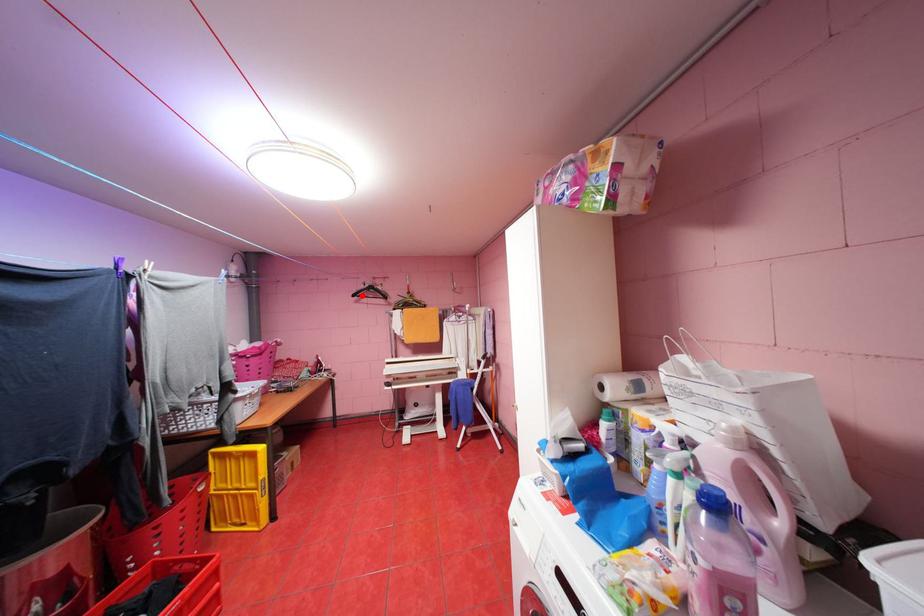
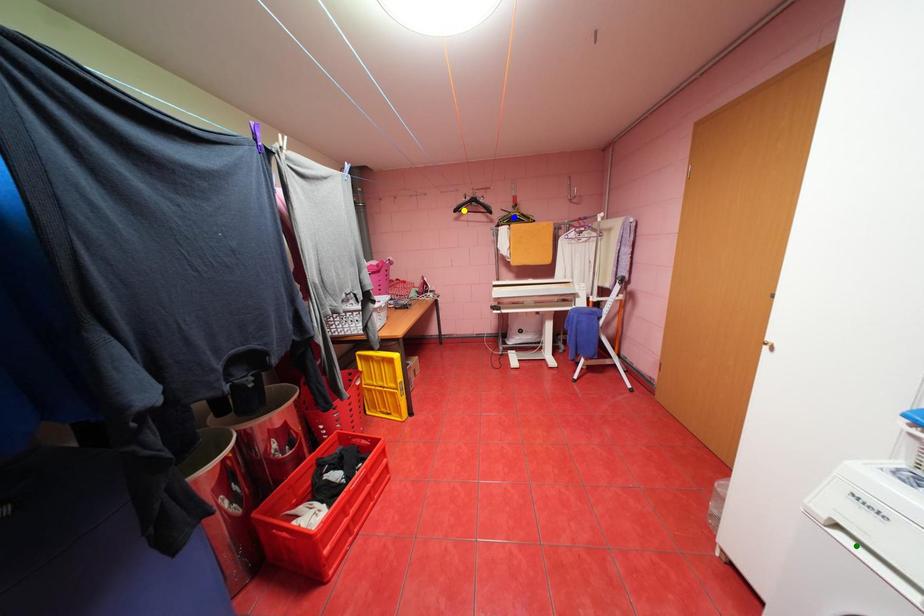
Question: I am providing you with two images of the same scene from different viewpoints. A red point is marked on the first image. You are given multiple points on the second image. Which spot in image 2 lines up with the point in image 1?

Choices:
 (A) green point
 (B) yellow point
 (C) blue point

Answer: (B)